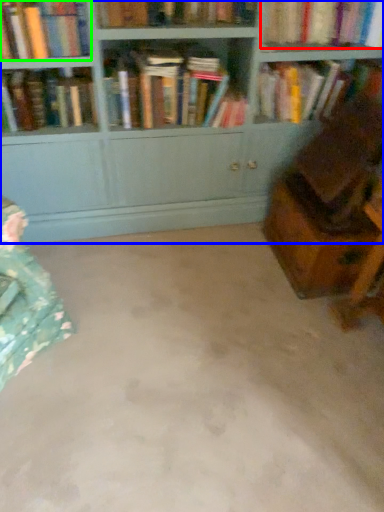
Question: Considering the real-world distances, which object is closest to book (highlighted by a red box)? bookcase (highlighted by a blue box) or book (highlighted by a green box).

Choices:
 (A) bookcase
 (B) book

Answer: (A)